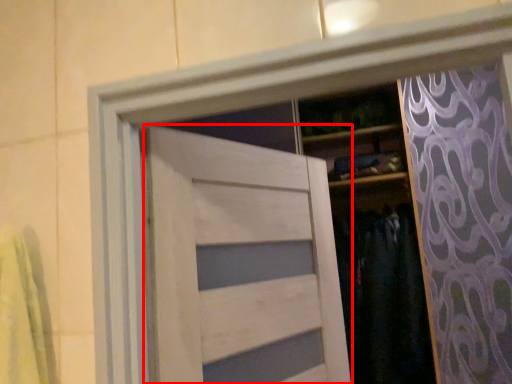
Question: From the image's perspective, where is door (annotated by the red box) located relative to clothing?

Choices:
 (A) above
 (B) below

Answer: (A)